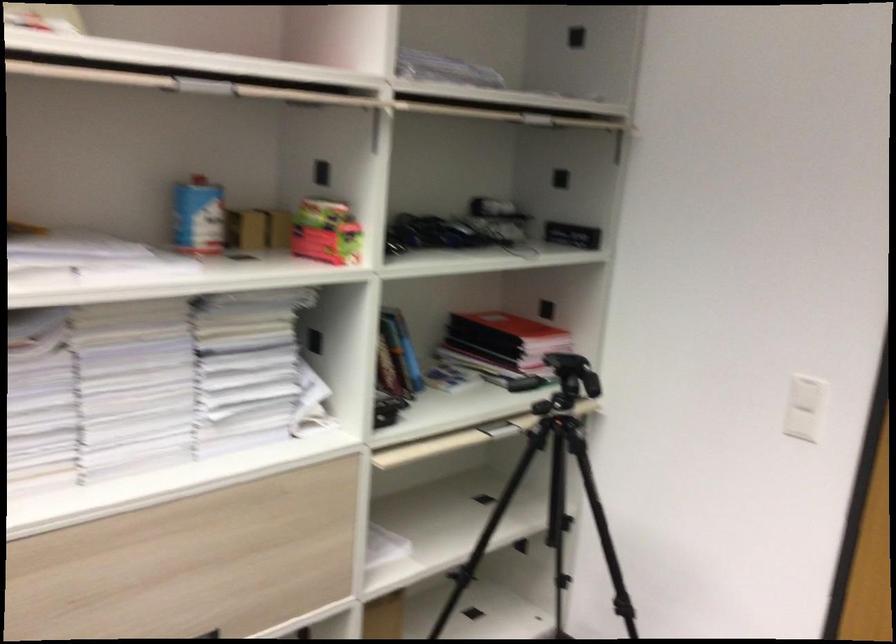
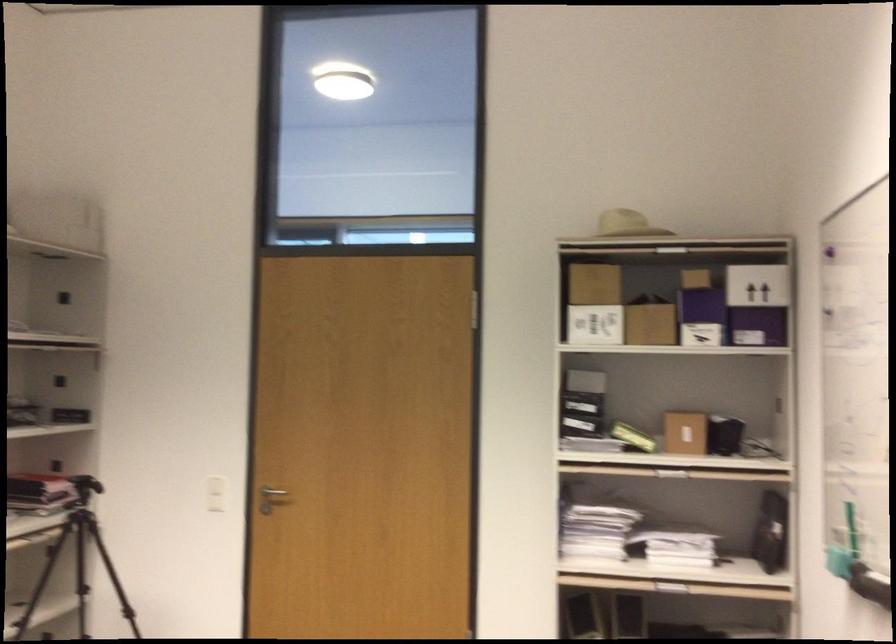
In the second image, find the point that corresponds to (797,408) in the first image.

(216, 494)